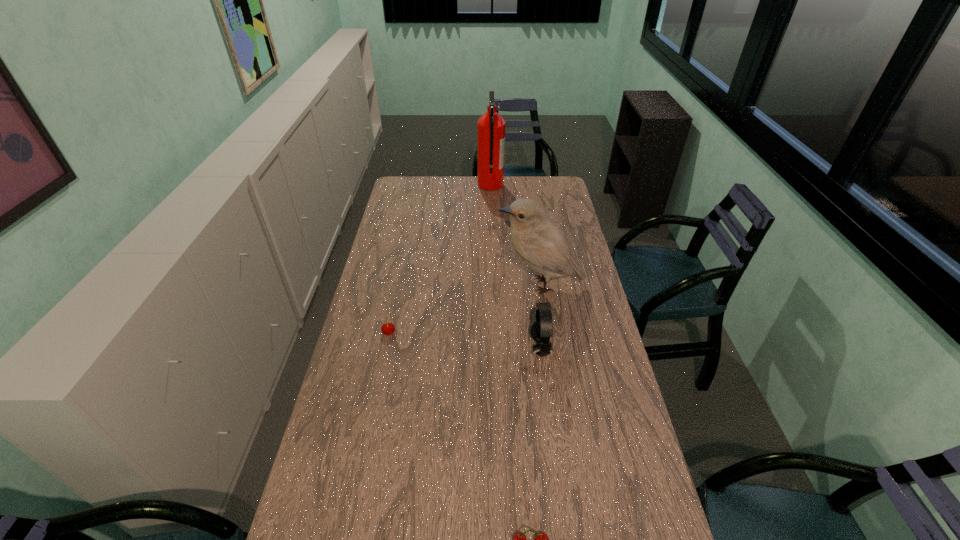
In order to click on vacant region located 0.130m on the face of the fourth shortest object in this screenshot , I will do `click(463, 285)`.

At what (x,y) coordinates should I click in order to perform the action: click on free spot located on the face of the fourth shortest object. Please return your answer as a coordinate pair (x, y). This screenshot has width=960, height=540. Looking at the image, I should click on (455, 285).

Where is `free space located on the face of the fourth shortest object`? This screenshot has width=960, height=540. free space located on the face of the fourth shortest object is located at coordinates (453, 285).

The image size is (960, 540). I want to click on free region located 0.200m on the ear cups of the earphone, so click(471, 348).

Identify the location of vacant space located on the ear cups of the earphone. (483, 348).

Identify the location of vacant space located 0.320m on the ear cups of the earphone. The image size is (960, 540). [437, 348].

The height and width of the screenshot is (540, 960). I want to click on free location located on the right of the left cherry, so click(490, 333).

The width and height of the screenshot is (960, 540). Identify the location of object that is at the far edge. (491, 127).

Locate an element on the screen. The height and width of the screenshot is (540, 960). object present at the left edge is located at coordinates (388, 328).

Find the location of `object at the right edge`. object at the right edge is located at coordinates (538, 241).